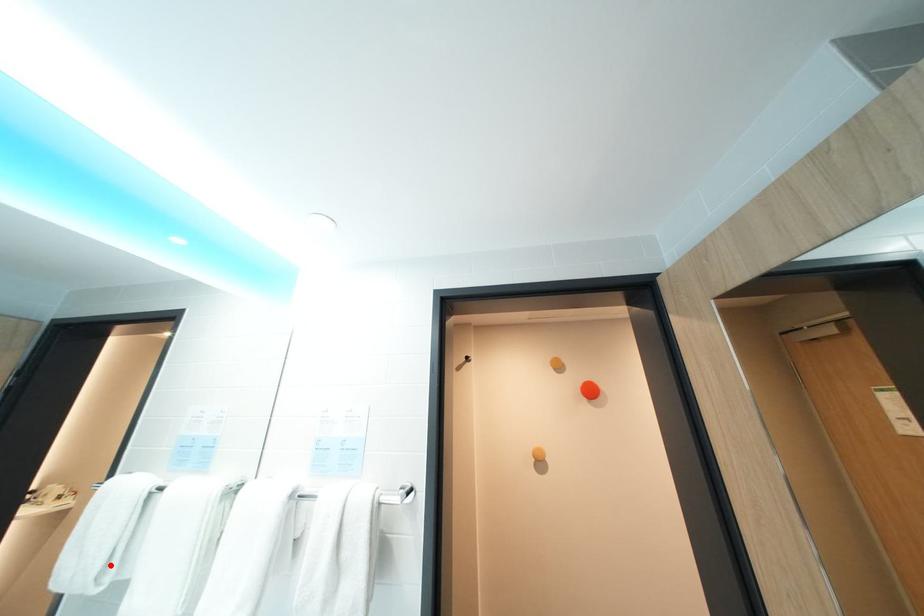
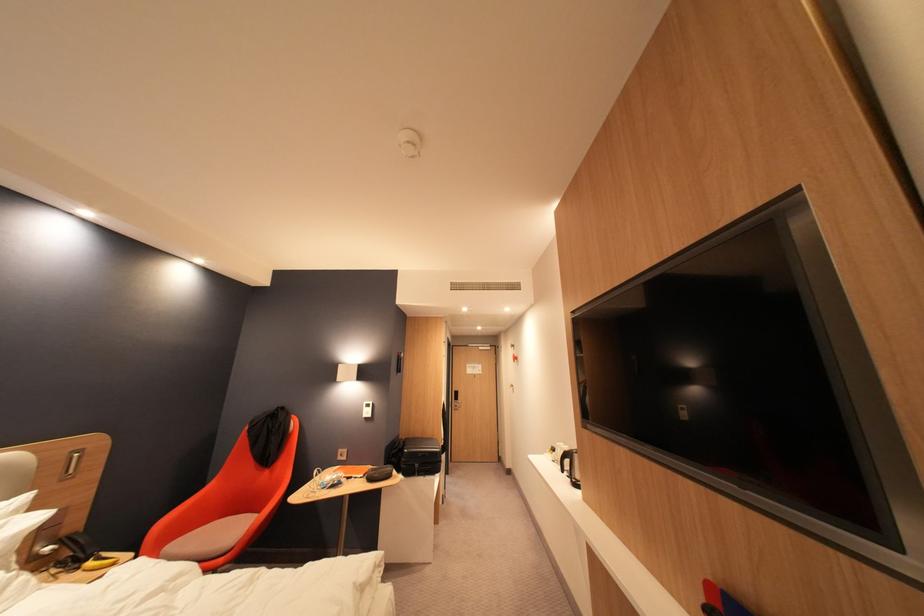
Question: I am providing you with two images of the same scene from different viewpoints. A red point is marked on the first image. Is the red point's position out of view in image 2?

Choices:
 (A) Yes
 (B) No

Answer: (A)